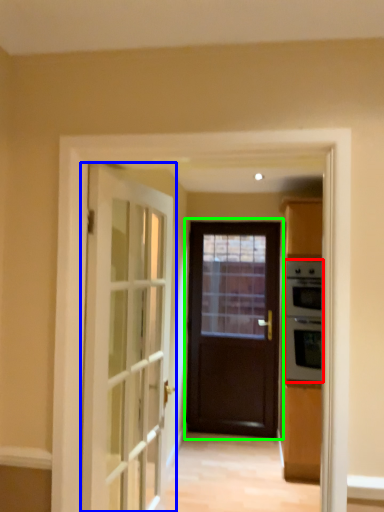
Question: Estimate the real-world distances between objects in this image. Which object is closer to appliance (highlighted by a red box), door (highlighted by a blue box) or door (highlighted by a green box)?

Choices:
 (A) door
 (B) door

Answer: (B)